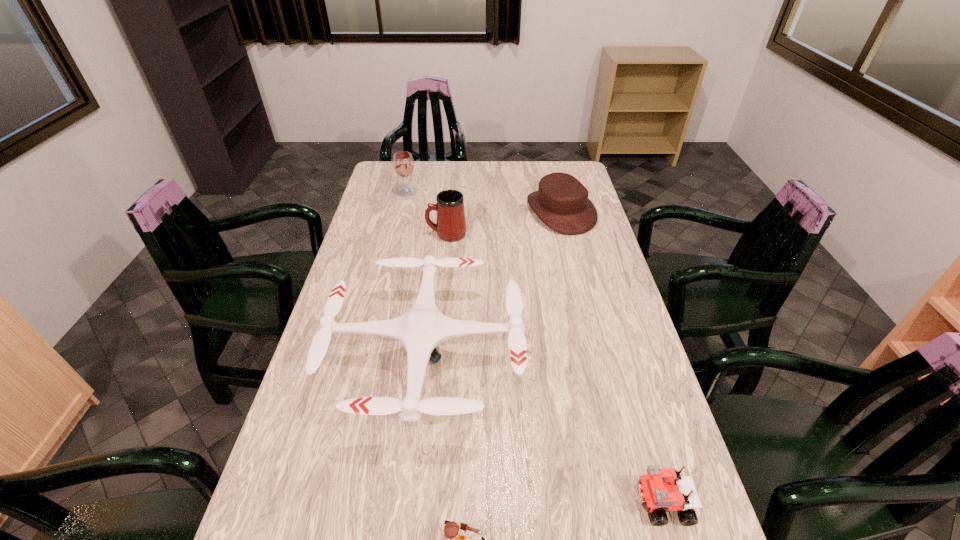
Where is `free space located 0.070m on the front of the hat`? free space located 0.070m on the front of the hat is located at coordinates (569, 248).

Locate an element on the screen. vacant space located 0.250m on the front-facing side of the right Lego is located at coordinates (516, 503).

This screenshot has width=960, height=540. What are the coordinates of `vacant space located on the front-facing side of the right Lego` in the screenshot? It's located at (488, 503).

The height and width of the screenshot is (540, 960). I want to click on vacant space located 0.240m on the front-facing side of the right Lego, so click(x=520, y=503).

This screenshot has width=960, height=540. What are the coordinates of `object that is positioned at the far edge` in the screenshot? It's located at (403, 163).

Where is `wineglass at the left edge`? wineglass at the left edge is located at coordinates (403, 163).

Identify the location of drone that is at the left edge. (421, 329).

Locate an element on the screen. This screenshot has height=540, width=960. hat that is at the right edge is located at coordinates (561, 202).

Where is `Lego located in the right edge section of the desktop`? The image size is (960, 540). Lego located in the right edge section of the desktop is located at coordinates (660, 488).

This screenshot has width=960, height=540. Find the location of `object that is at the far left corner`. object that is at the far left corner is located at coordinates (403, 163).